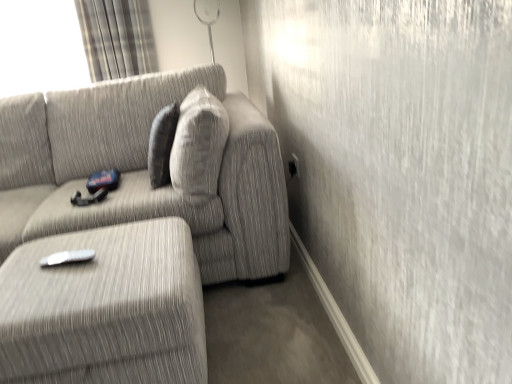
Question: From the image's perspective, is white plastic remote at lower left beneath plaid fabric curtain at upper left?

Choices:
 (A) yes
 (B) no

Answer: (A)

Question: Is the depth of white plastic remote at lower left less than that of plaid fabric curtain at upper left?

Choices:
 (A) yes
 (B) no

Answer: (A)

Question: From the image's perspective, is white plastic remote at lower left over plaid fabric curtain at upper left?

Choices:
 (A) no
 (B) yes

Answer: (A)

Question: Does white plastic remote at lower left have a lesser height compared to plaid fabric curtain at upper left?

Choices:
 (A) yes
 (B) no

Answer: (A)

Question: Is white plastic remote at lower left bigger than plaid fabric curtain at upper left?

Choices:
 (A) yes
 (B) no

Answer: (B)

Question: In terms of size, does white plastic remote at lower left appear bigger or smaller than plaid fabric curtain at upper left?

Choices:
 (A) big
 (B) small

Answer: (B)

Question: Considering the positions of point (83, 249) and point (103, 33), is point (83, 249) closer or farther from the camera than point (103, 33)?

Choices:
 (A) farther
 (B) closer

Answer: (B)

Question: From the image's perspective, is white plastic remote at lower left above or below plaid fabric curtain at upper left?

Choices:
 (A) above
 (B) below

Answer: (B)

Question: Do you think white plastic remote at lower left is within plaid fabric curtain at upper left, or outside of it?

Choices:
 (A) outside
 (B) inside

Answer: (A)

Question: Considering the positions of point (131, 62) and point (214, 241), is point (131, 62) closer or farther from the camera than point (214, 241)?

Choices:
 (A) farther
 (B) closer

Answer: (A)

Question: In the image, is plaid fabric curtain at upper left positioned in front of or behind textured gray couch at center?

Choices:
 (A) behind
 (B) front

Answer: (A)

Question: From a real-world perspective, relative to textured gray couch at center, is plaid fabric curtain at upper left vertically above or below?

Choices:
 (A) above
 (B) below

Answer: (A)

Question: From the image's perspective, is plaid fabric curtain at upper left positioned above or below textured gray couch at center?

Choices:
 (A) below
 (B) above

Answer: (B)

Question: In terms of width, does plaid fabric curtain at upper left look wider or thinner when compared to white plastic remote at lower left?

Choices:
 (A) wide
 (B) thin

Answer: (A)

Question: From the image's perspective, is plaid fabric curtain at upper left positioned above or below white plastic remote at lower left?

Choices:
 (A) below
 (B) above

Answer: (B)